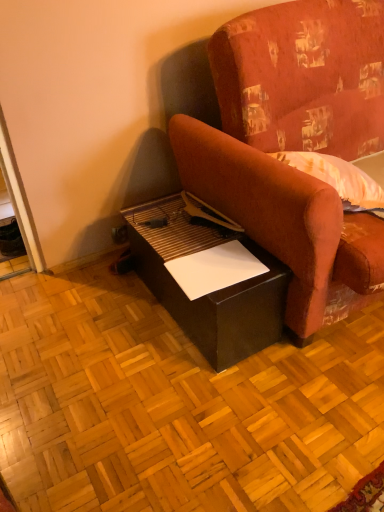
Locate an element on the screen. This screenshot has width=384, height=512. velvet-like red couch at center is located at coordinates (295, 145).

This screenshot has width=384, height=512. What do you see at coordinates (295, 145) in the screenshot? I see `velvet-like red couch at center` at bounding box center [295, 145].

Measure the distance between matte black table at lower center and camera.

The depth of matte black table at lower center is 4.35 feet.

Where is `matte black table at lower center`? This screenshot has width=384, height=512. matte black table at lower center is located at coordinates (212, 293).

What is the approximate height of matte black table at lower center?

37.85 centimeters.

The width and height of the screenshot is (384, 512). What do you see at coordinates (212, 293) in the screenshot?
I see `matte black table at lower center` at bounding box center [212, 293].

I want to click on velvet-like red couch at center, so click(x=295, y=145).

Considering the relative positions of matte black table at lower center and velvet-like red couch at center in the image provided, is matte black table at lower center to the right of velvet-like red couch at center from the viewer's perspective?

No, matte black table at lower center is not to the right of velvet-like red couch at center.

Which object is further away from the camera, matte black table at lower center or velvet-like red couch at center?

Positioned behind is matte black table at lower center.

Considering the points (214, 335) and (343, 79), which point is behind, point (214, 335) or point (343, 79)?

The point (343, 79) is farther from the camera.

From the image's perspective, is matte black table at lower center positioned above or below velvet-like red couch at center?

Clearly, from the image's perspective, matte black table at lower center is below velvet-like red couch at center.

From a real-world perspective, which object rests below the other?

matte black table at lower center.

Does matte black table at lower center have a greater width compared to velvet-like red couch at center?

In fact, matte black table at lower center might be narrower than velvet-like red couch at center.

Which of these two, matte black table at lower center or velvet-like red couch at center, stands taller?

velvet-like red couch at center.

Between matte black table at lower center and velvet-like red couch at center, which one has larger size?

velvet-like red couch at center.

Is matte black table at lower center not within velvet-like red couch at center?

Indeed, matte black table at lower center is completely outside velvet-like red couch at center.

Would you consider matte black table at lower center to be distant from velvet-like red couch at center?

No, matte black table at lower center is in close proximity to velvet-like red couch at center.

Does matte black table at lower center turn towards velvet-like red couch at center?

No.

You are a GUI agent. You are given a task and a screenshot of the screen. Output one action in this format:
    pyautogui.click(x=<x>, y=<y>)
    Task: Click on the table lying behind the velvet-like red couch at center
    Image resolution: width=384 pixels, height=512 pixels.
    Given the screenshot: What is the action you would take?
    pyautogui.click(x=212, y=293)

Is velvet-like red couch at center to the left of matte black table at lower center from the viewer's perspective?

In fact, velvet-like red couch at center is to the right of matte black table at lower center.

Is velvet-like red couch at center in front of or behind matte black table at lower center in the image?

Visually, velvet-like red couch at center is located in front of matte black table at lower center.

Does point (355, 222) come closer to viewer compared to point (213, 309)?

No.

From the picture: From the image's perspective, which is below, velvet-like red couch at center or matte black table at lower center?

From the image's view, matte black table at lower center is below.

From a real-world perspective, between velvet-like red couch at center and matte black table at lower center, who is vertically higher?

velvet-like red couch at center.

Which of these two, velvet-like red couch at center or matte black table at lower center, is thinner?

matte black table at lower center.

In terms of height, does velvet-like red couch at center look taller or shorter compared to matte black table at lower center?

velvet-like red couch at center is taller than matte black table at lower center.

Who is smaller, velvet-like red couch at center or matte black table at lower center?

With smaller size is matte black table at lower center.

Is velvet-like red couch at center not inside matte black table at lower center?

Yes, velvet-like red couch at center is located beyond the bounds of matte black table at lower center.

From the picture: Is velvet-like red couch at center positioned far away from matte black table at lower center?

velvet-like red couch at center is near matte black table at lower center, not far away.

Is velvet-like red couch at center oriented away from matte black table at lower center?

No, velvet-like red couch at center is not facing the opposite direction of matte black table at lower center.

What's the angular difference between velvet-like red couch at center and matte black table at lower center's facing directions?

The facing directions of velvet-like red couch at center and matte black table at lower center are 1.05 degrees apart.

The image size is (384, 512). In order to click on table lying on the left of velvet-like red couch at center in this screenshot , I will do `click(212, 293)`.

Locate an element on the screen. This screenshot has height=512, width=384. studio couch that appears on the right of matte black table at lower center is located at coordinates (295, 145).

The image size is (384, 512). What are the coordinates of `studio couch in front of the matte black table at lower center` in the screenshot? It's located at (295, 145).